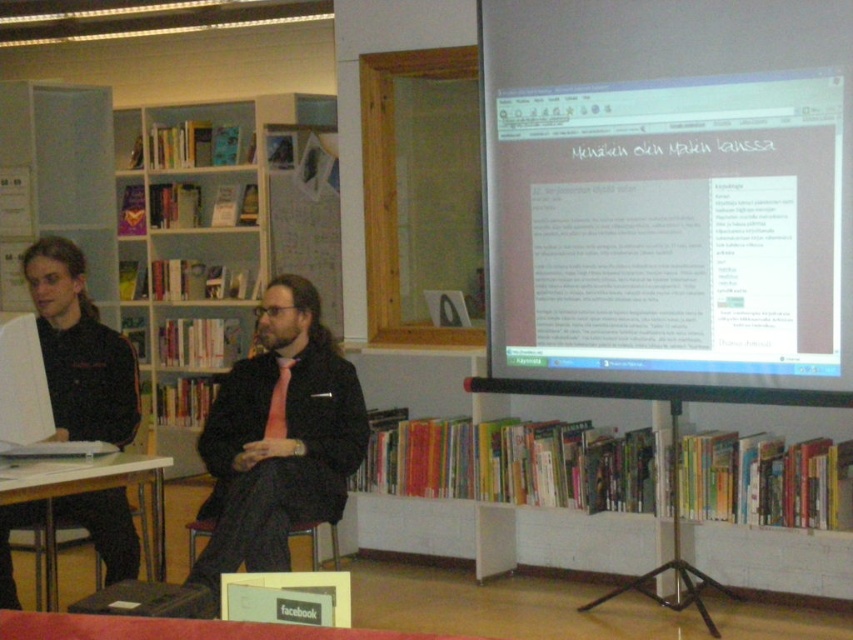
Can you confirm if white glossy projector screen at upper right is shorter than black matte shirt at left?

Incorrect, white glossy projector screen at upper right's height does not fall short of black matte shirt at left's.

Who is more forward, (706, 74) or (62, 378)?

Point (62, 378) is more forward.

What do you see at coordinates (669, 196) in the screenshot?
I see `white glossy projector screen at upper right` at bounding box center [669, 196].

The height and width of the screenshot is (640, 853). What are the coordinates of `white glossy projector screen at upper right` in the screenshot? It's located at (669, 196).

Identify the location of white glossy projector screen at upper right. (669, 196).

Who is more forward, (619, 387) or (38, 486)?

Point (38, 486) is in front.

You are a GUI agent. You are given a task and a screenshot of the screen. Output one action in this format:
    pyautogui.click(x=<x>, y=<y>)
    Task: Click on the white glossy projector screen at upper right
    The image size is (853, 640).
    Given the screenshot: What is the action you would take?
    pyautogui.click(x=669, y=196)

In order to click on white glossy projector screen at upper right in this screenshot , I will do `click(669, 196)`.

Which is more to the right, white glossy projector screen at upper right or white wooden bookshelf at left?

white glossy projector screen at upper right

Can you confirm if white glossy projector screen at upper right is positioned to the left of white wooden bookshelf at left?

Incorrect, white glossy projector screen at upper right is not on the left side of white wooden bookshelf at left.

The image size is (853, 640). In order to click on white glossy projector screen at upper right in this screenshot , I will do `click(669, 196)`.